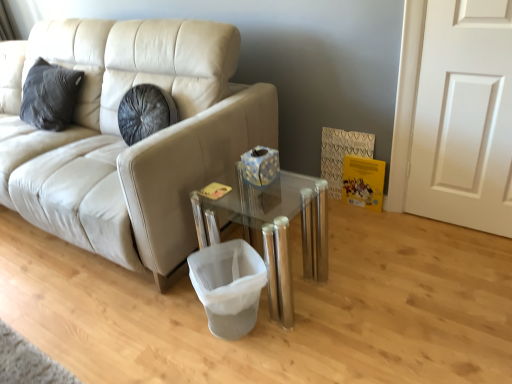
Find the location of `beige leather couch at left`. beige leather couch at left is located at coordinates (123, 142).

This screenshot has height=384, width=512. What do you see at coordinates (272, 229) in the screenshot? I see `transparent glass table at center` at bounding box center [272, 229].

In the scene shown: Measure the distance between point (459, 58) and camera.

Point (459, 58) and camera are 5.87 feet apart from each other.

What are the coordinates of `beige leather couch at left` in the screenshot? It's located at click(123, 142).

You are a GUI agent. You are given a task and a screenshot of the screen. Output one action in this format:
    pyautogui.click(x=<x>, y=<y>)
    Task: Click on the laundry basket below the transparent glass table at center (from the image's perspective)
    This screenshot has width=512, height=384.
    Given the screenshot: What is the action you would take?
    pyautogui.click(x=228, y=286)

In the scene shown: Is transparent glass table at center wider or thinner than white fabric laundry basket at lower center?

Considering their sizes, transparent glass table at center looks broader than white fabric laundry basket at lower center.

Is transparent glass table at center located outside white fabric laundry basket at lower center?

Yes, transparent glass table at center is located beyond the bounds of white fabric laundry basket at lower center.

Is transparent glass table at center not close to white fabric laundry basket at lower center?

No, transparent glass table at center is not far away from white fabric laundry basket at lower center.

Is transparent glass table at center bigger than white matte door at right?

Correct, transparent glass table at center is larger in size than white matte door at right.

Considering the positions of objects transparent glass table at center and white matte door at right in the image provided, who is more to the right, transparent glass table at center or white matte door at right?

From the viewer's perspective, white matte door at right appears more on the right side.

Locate an element on the screen. door above the transparent glass table at center (from the image's perspective) is located at coordinates (464, 117).

Does point (68, 148) appear closer or farther from the camera than point (205, 208)?

Point (68, 148) is positioned farther from the camera compared to point (205, 208).

Is beige leather couch at left turned away from transparent glass table at center?

beige leather couch at left is not turned away from transparent glass table at center.

From the image's perspective, which is above, beige leather couch at left or transparent glass table at center?

beige leather couch at left appears higher in the image.

From a real-world perspective, does beige leather couch at left stand above transparent glass table at center?

Yes, from a real-world perspective, beige leather couch at left is over transparent glass table at center

Can you confirm if white fabric laundry basket at lower center is shorter than beige leather couch at left?

Indeed, white fabric laundry basket at lower center has a lesser height compared to beige leather couch at left.

Who is smaller, white fabric laundry basket at lower center or beige leather couch at left?

white fabric laundry basket at lower center.

Considering the relative sizes of white fabric laundry basket at lower center and beige leather couch at left in the image provided, is white fabric laundry basket at lower center thinner than beige leather couch at left?

Yes.

Is point (236, 325) farther from viewer compared to point (74, 198)?

No, (236, 325) is in front of (74, 198).

From a real-world perspective, which is physically below, white fabric laundry basket at lower center or white matte door at right?

white fabric laundry basket at lower center, from a real-world perspective.

Who is bigger, white fabric laundry basket at lower center or white matte door at right?

Bigger between the two is white fabric laundry basket at lower center.

Measure the distance from white fabric laundry basket at lower center to white matte door at right.

white fabric laundry basket at lower center is 1.14 meters away from white matte door at right.

Would you say white fabric laundry basket at lower center is outside white matte door at right?

Absolutely, white fabric laundry basket at lower center is external to white matte door at right.

Considering the positions of point (479, 42) and point (247, 329), is point (479, 42) closer or farther from the camera than point (247, 329)?

Clearly, point (479, 42) is more distant from the camera than point (247, 329).

Is white matte door at right not close to white fabric laundry basket at lower center?

That's right, there is a large distance between white matte door at right and white fabric laundry basket at lower center.

Would you say white matte door at right is to the left or to the right of white fabric laundry basket at lower center in the picture?

white matte door at right is positioned on white fabric laundry basket at lower center's right side.

Could beige leather couch at left be considered to be inside white matte door at right?

No, beige leather couch at left is not a part of white matte door at right.

Can you confirm if white matte door at right is bigger than beige leather couch at left?

No.

Which is closer, (424, 143) or (180, 187)?

Positioned in front is point (180, 187).

You are a GUI agent. You are given a task and a screenshot of the screen. Output one action in this format:
    pyautogui.click(x=<x>, y=<y>)
    Task: Click on the door that appears above the beige leather couch at left (from a real-world perspective)
    The height and width of the screenshot is (384, 512).
    Given the screenshot: What is the action you would take?
    pyautogui.click(x=464, y=117)

Where is `table in front of the white fabric laundry basket at lower center`? table in front of the white fabric laundry basket at lower center is located at coordinates (272, 229).

The width and height of the screenshot is (512, 384). What are the coordinates of `table that is below the white matte door at right (from the image's perspective)` in the screenshot? It's located at (272, 229).

When comparing their distances from transparent glass table at center, does beige leather couch at left or white fabric laundry basket at lower center seem closer?

Among the two, white fabric laundry basket at lower center is located nearer to transparent glass table at center.

From the image, which object appears to be farther from white fabric laundry basket at lower center, white matte door at right or beige leather couch at left?

white matte door at right.

Looking at the image, which one is located closer to white fabric laundry basket at lower center, beige leather couch at left or white matte door at right?

beige leather couch at left lies closer to white fabric laundry basket at lower center than the other object.

Considering their positions, is white matte door at right positioned closer to beige leather couch at left than white fabric laundry basket at lower center?

white fabric laundry basket at lower center lies closer to beige leather couch at left than the other object.

Considering their positions, is beige leather couch at left positioned closer to transparent glass table at center than white matte door at right?

Based on the image, beige leather couch at left appears to be nearer to transparent glass table at center.

Which object lies nearer to the anchor point beige leather couch at left, transparent glass table at center or white matte door at right?

transparent glass table at center lies closer to beige leather couch at left than the other object.

Which object lies further to the anchor point transparent glass table at center, white fabric laundry basket at lower center or beige leather couch at left?

The object further to transparent glass table at center is beige leather couch at left.

From the image, which object appears to be farther from white matte door at right, white fabric laundry basket at lower center or transparent glass table at center?

white fabric laundry basket at lower center lies further to white matte door at right than the other object.

Where is `laundry basket between beige leather couch at left and white matte door at right from left to right`? laundry basket between beige leather couch at left and white matte door at right from left to right is located at coordinates (228, 286).

Locate an element on the screen. The height and width of the screenshot is (384, 512). laundry basket situated between beige leather couch at left and transparent glass table at center from left to right is located at coordinates (228, 286).

In order to click on table situated between beige leather couch at left and white matte door at right from left to right in this screenshot , I will do `click(272, 229)`.

Find the location of a particular element. The width and height of the screenshot is (512, 384). table between white fabric laundry basket at lower center and white matte door at right from left to right is located at coordinates (272, 229).